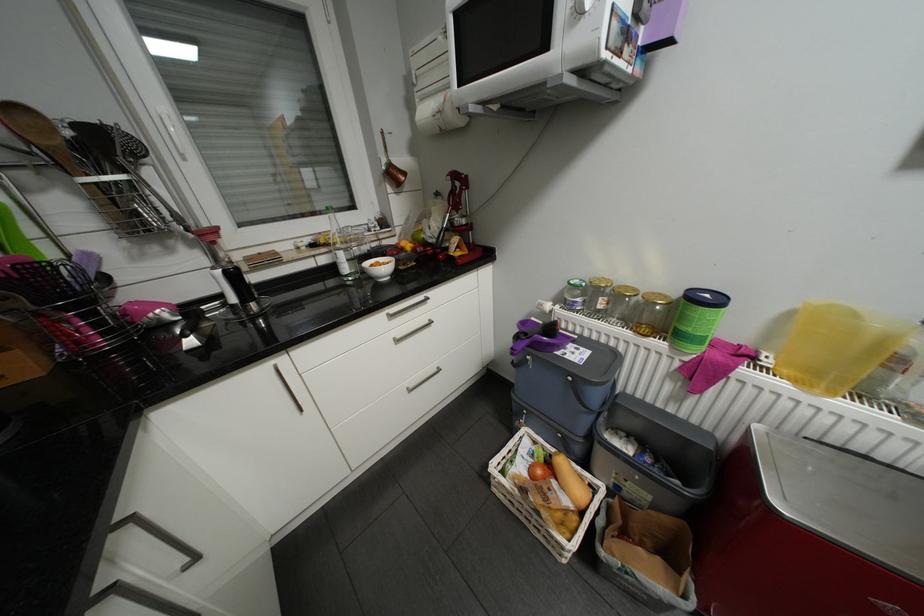
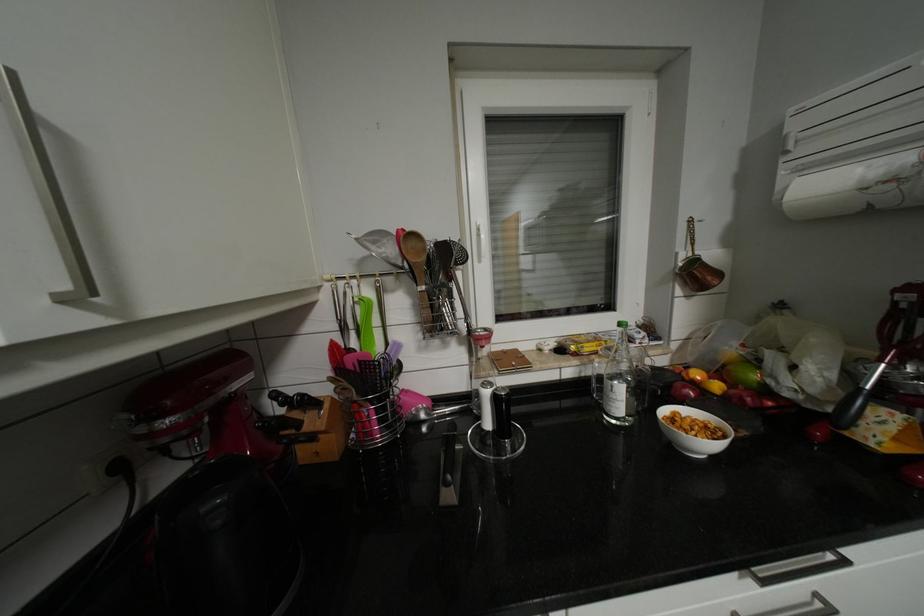
Where in the second image is the point corresponding to (397,164) from the first image?

(702, 261)